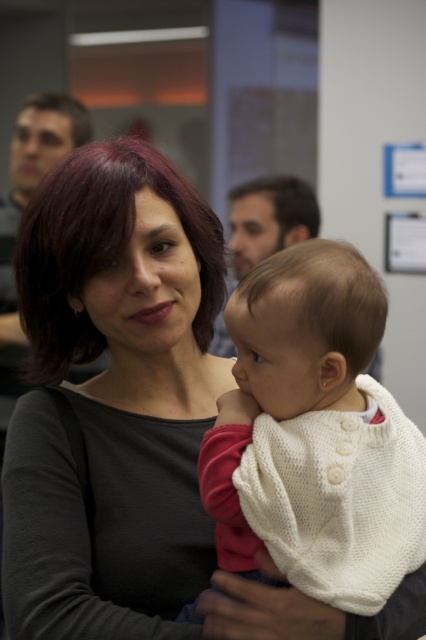
You are an interior designer planning to place a small plant between the matte black sweater at center and the white knitted sweater at center. Since you want the plant to be visible from above both sweaters, which sweater should the plant be placed closer to?

The matte black sweater at center is much taller than the white knitted sweater at center, so the plant should be placed closer to the shorter white knitted sweater at center to ensure visibility from above both.

You are an interior designer planning to place a decorative item between the matte black sweater at center and the white knitted sweater at center. To ensure it fits, you need to know which sweater is wider. Which one is wider?

The matte black sweater at center might be wider than white knitted sweater at center, so it is likely the wider one.

You are an observer in the room. You see a matte black sweater at center and a white knitted sweater at center. Which sweater is closer to you?

The matte black sweater at center is closer to you because it is further to the viewer than the white knitted sweater at center.